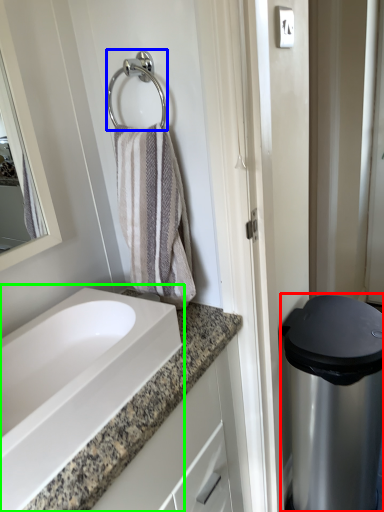
Question: Considering the real-world distances, which object is closest to appliance (highlighted by a red box)? shower (highlighted by a blue box) or sink (highlighted by a green box).

Choices:
 (A) shower
 (B) sink

Answer: (B)